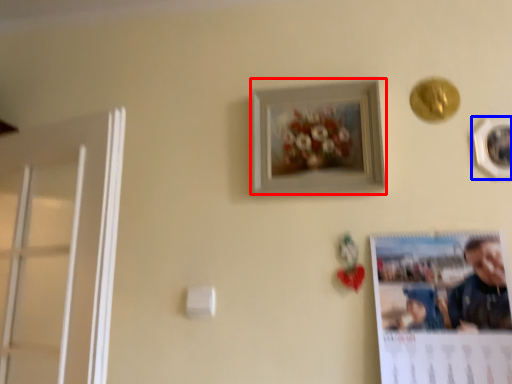
Question: Which of the following is the closest to the observer, picture frame (highlighted by a red box) or picture frame (highlighted by a blue box)?

Choices:
 (A) picture frame
 (B) picture frame

Answer: (B)